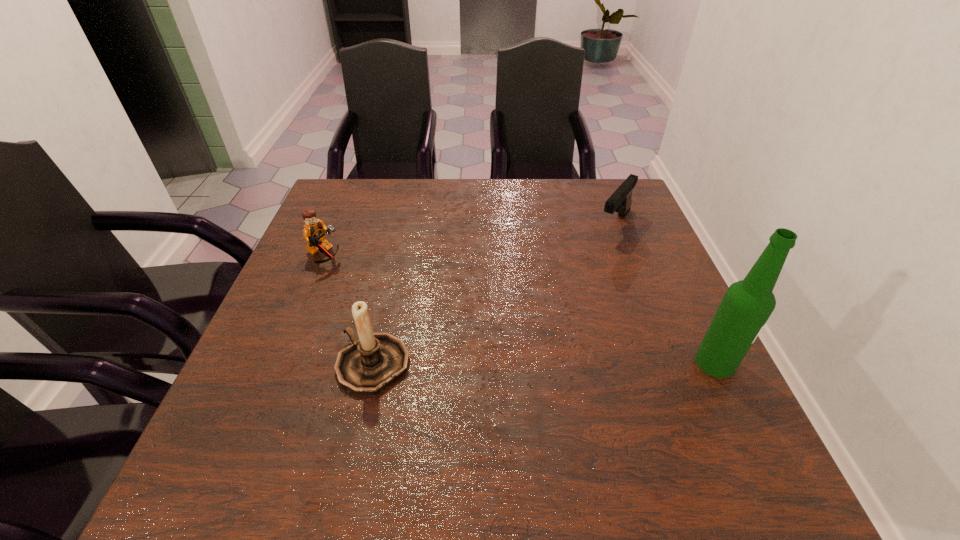
The width and height of the screenshot is (960, 540). Find the location of `vacant space on the desktop that is between the candle holder and the beer bottle and is positioned on the front-facing side of the pistol`. vacant space on the desktop that is between the candle holder and the beer bottle and is positioned on the front-facing side of the pistol is located at coordinates (501, 364).

Where is `vacant spot on the desktop that is between the candle holder and the beer bottle and is positioned holding a crossbow in the hands of the leftmost object`? The height and width of the screenshot is (540, 960). vacant spot on the desktop that is between the candle holder and the beer bottle and is positioned holding a crossbow in the hands of the leftmost object is located at coordinates (574, 363).